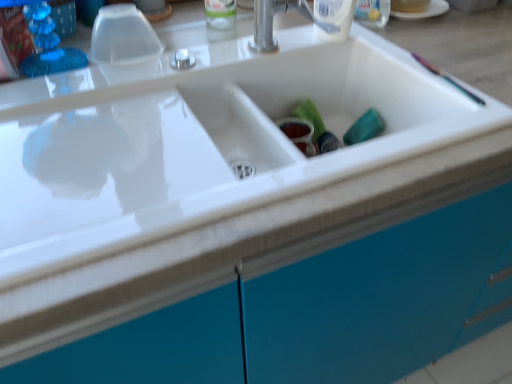
In order to click on vacant area that lies to the right of white glossy bottle at upper right in this screenshot , I will do `click(405, 43)`.